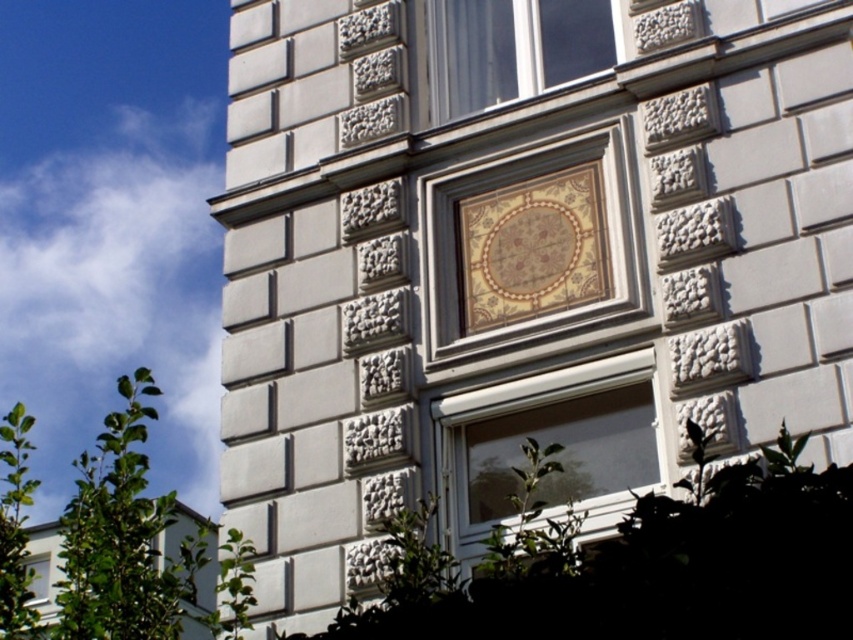
Question: Does gold mosaic tile at center appear over clear glass window at upper center?

Choices:
 (A) yes
 (B) no

Answer: (B)

Question: Estimate the real-world distances between objects in this image. Which object is closer to the clear glass window at upper center?

Choices:
 (A) clear glass window at lower left
 (B) gold mosaic tile at center
 (C) white plastic window at center

Answer: (B)

Question: Does clear glass window at upper center come behind clear glass window at lower left?

Choices:
 (A) no
 (B) yes

Answer: (B)

Question: Is gold mosaic tile at center thinner than white plastic window at center?

Choices:
 (A) no
 (B) yes

Answer: (B)

Question: Which of the following is the closest to the observer?

Choices:
 (A) gold mosaic tile at center
 (B) clear glass window at lower left
 (C) white plastic window at center
 (D) clear glass window at upper center

Answer: (B)

Question: Based on their relative distances, which object is farther from the clear glass window at lower left?

Choices:
 (A) clear glass window at upper center
 (B) white plastic window at center

Answer: (A)